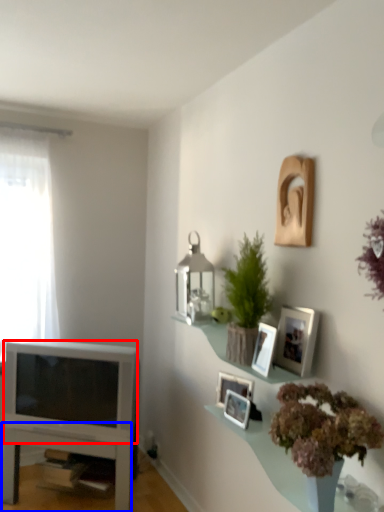
Question: Among these objects, which one is nearest to the camera, television (highlighted by a red box) or table (highlighted by a blue box)?

Choices:
 (A) television
 (B) table

Answer: (A)